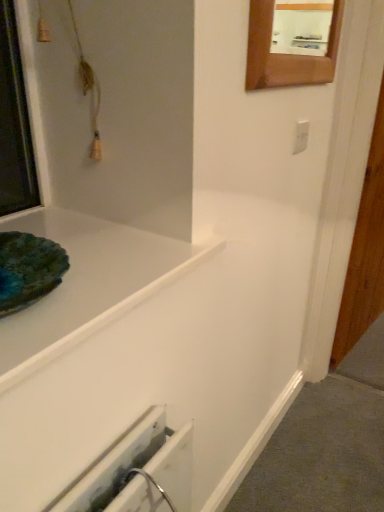
Measure the distance between white plastic electric outlet at upper right and camera.

The distance of white plastic electric outlet at upper right from camera is 3.65 feet.

Locate an element on the screen. The width and height of the screenshot is (384, 512). white plastic electric outlet at upper right is located at coordinates (301, 137).

Is white glossy bathtub at upper left wider or thinner than white plastic electric outlet at upper right?

white glossy bathtub at upper left is wider than white plastic electric outlet at upper right.

Which is behind, point (150, 237) or point (302, 142)?

The point (302, 142) is behind.

Which object is positioned more to the left, white glossy bathtub at upper left or white plastic electric outlet at upper right?

Positioned to the left is white glossy bathtub at upper left.

Can you confirm if white glossy bathtub at upper left is smaller than white plastic electric outlet at upper right?

No.

Is white glossy bathtub at upper left aimed at wooden frame mirror at upper right?

No, white glossy bathtub at upper left is not oriented towards wooden frame mirror at upper right.

Between white glossy bathtub at upper left and wooden frame mirror at upper right, which one has larger size?

white glossy bathtub at upper left.

Is point (85, 237) positioned after point (323, 79)?

No, it is not.

The height and width of the screenshot is (512, 384). I want to click on mirror that is above the white glossy bathtub at upper left (from a real-world perspective), so click(x=287, y=54).

Does wooden frame mirror at upper right come in front of white glossy bathtub at upper left?

No.

Is white glossy bathtub at upper left completely or partially inside wooden frame mirror at upper right?

Definitely not — white glossy bathtub at upper left is not inside wooden frame mirror at upper right.

Does wooden frame mirror at upper right have a lesser height compared to white glossy bathtub at upper left?

In fact, wooden frame mirror at upper right may be taller than white glossy bathtub at upper left.

Considering the points (275, 7) and (295, 153), which point is behind, point (275, 7) or point (295, 153)?

The point (295, 153) is more distant.

Looking at this image, is wooden frame mirror at upper right looking in the opposite direction of white plastic electric outlet at upper right?

No, white plastic electric outlet at upper right is not at the back of wooden frame mirror at upper right.

Does wooden frame mirror at upper right appear on the right side of white plastic electric outlet at upper right?

Incorrect, wooden frame mirror at upper right is not on the right side of white plastic electric outlet at upper right.

Can you confirm if wooden frame mirror at upper right is smaller than white plastic electric outlet at upper right?

Incorrect, wooden frame mirror at upper right is not smaller in size than white plastic electric outlet at upper right.

Is white plastic electric outlet at upper right oriented towards white glossy bathtub at upper left?

No, white plastic electric outlet at upper right is not facing towards white glossy bathtub at upper left.

From a real-world perspective, is white plastic electric outlet at upper right located beneath white glossy bathtub at upper left?

Incorrect, from a real-world perspective, white plastic electric outlet at upper right is higher than white glossy bathtub at upper left.

Which is farther, [305,127] or [12,396]?

Point [305,127]

Is white plastic electric outlet at upper right thinner than white glossy bathtub at upper left?

Yes.

Between white plastic electric outlet at upper right and wooden frame mirror at upper right, which one is positioned in front?

wooden frame mirror at upper right is in front.

In the scene shown: In terms of width, does white plastic electric outlet at upper right look wider or thinner when compared to wooden frame mirror at upper right?

Considering their sizes, white plastic electric outlet at upper right looks slimmer than wooden frame mirror at upper right.

In the scene shown: Which is more to the right, white plastic electric outlet at upper right or wooden frame mirror at upper right?

Positioned to the right is white plastic electric outlet at upper right.

Does point (303, 128) appear closer or farther from the camera than point (317, 71)?

Point (303, 128).

This screenshot has width=384, height=512. I want to click on electric outlet behind the white glossy bathtub at upper left, so click(301, 137).

Identify the location of mirror to the right of white glossy bathtub at upper left. This screenshot has width=384, height=512. (287, 54).

Which object lies nearer to the anchor point wooden frame mirror at upper right, white glossy bathtub at upper left or white plastic electric outlet at upper right?

white plastic electric outlet at upper right is positioned closer to the anchor wooden frame mirror at upper right.

Based on their spatial positions, is white glossy bathtub at upper left or wooden frame mirror at upper right closer to white plastic electric outlet at upper right?

wooden frame mirror at upper right is closer to white plastic electric outlet at upper right.

Based on the photo, considering their positions, is white plastic electric outlet at upper right positioned closer to white glossy bathtub at upper left than wooden frame mirror at upper right?

Based on the image, wooden frame mirror at upper right appears to be nearer to white glossy bathtub at upper left.

Considering their positions, is white plastic electric outlet at upper right positioned closer to wooden frame mirror at upper right than white glossy bathtub at upper left?

The object closer to wooden frame mirror at upper right is white plastic electric outlet at upper right.

When comparing their distances from white glossy bathtub at upper left, does wooden frame mirror at upper right or white plastic electric outlet at upper right seem closer?

wooden frame mirror at upper right is positioned closer to the anchor white glossy bathtub at upper left.

When comparing their distances from white plastic electric outlet at upper right, does wooden frame mirror at upper right or white glossy bathtub at upper left seem closer?

wooden frame mirror at upper right lies closer to white plastic electric outlet at upper right than the other object.

At what (x,y) coordinates should I click in order to perform the action: click on mirror between white glossy bathtub at upper left and white plastic electric outlet at upper right along the z-axis. Please return your answer as a coordinate pair (x, y). Image resolution: width=384 pixels, height=512 pixels. Looking at the image, I should click on (287, 54).